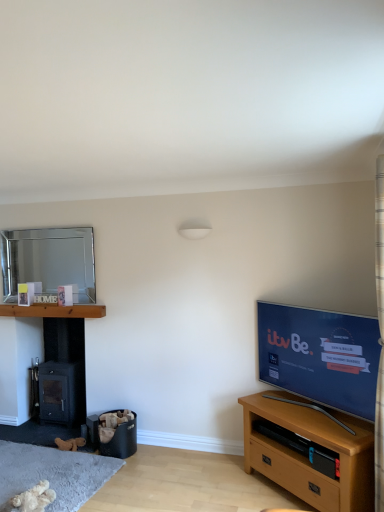
This screenshot has width=384, height=512. In order to click on vacant region above fluffy beige teddy bear at lower left (from a real-world perspective) in this screenshot , I will do `click(43, 471)`.